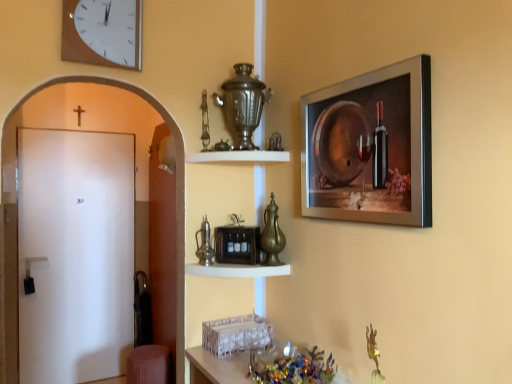
Question: From the image's perspective, is white matte door at left above metallic glass bowl at lower center?

Choices:
 (A) no
 (B) yes

Answer: (B)

Question: Would you say white matte door at left contains metallic glass bowl at lower center?

Choices:
 (A) yes
 (B) no

Answer: (B)

Question: Is white matte door at left thinner than metallic glass bowl at lower center?

Choices:
 (A) yes
 (B) no

Answer: (A)

Question: Is white matte door at left wider than metallic glass bowl at lower center?

Choices:
 (A) yes
 (B) no

Answer: (B)

Question: Considering the relative positions of white matte door at left and metallic glass bowl at lower center in the image provided, is white matte door at left in front of metallic glass bowl at lower center?

Choices:
 (A) no
 (B) yes

Answer: (A)

Question: Can you confirm if white matte door at left is positioned to the right of metallic glass bowl at lower center?

Choices:
 (A) no
 (B) yes

Answer: (A)

Question: From the image's perspective, does metallic black toaster at center, the 2th shelf in the top-to-bottom sequence, appear higher than metallic glass bowl at lower center?

Choices:
 (A) no
 (B) yes

Answer: (B)

Question: From a real-world perspective, is metallic black toaster at center, the 2th shelf in the top-to-bottom sequence, under metallic glass bowl at lower center?

Choices:
 (A) yes
 (B) no

Answer: (B)

Question: Is metallic black toaster at center, which is counted as the 1th shelf, starting from the bottom, directly adjacent to metallic glass bowl at lower center?

Choices:
 (A) yes
 (B) no

Answer: (B)

Question: Is metallic black toaster at center, the 2th shelf in the top-to-bottom sequence, surrounding metallic glass bowl at lower center?

Choices:
 (A) yes
 (B) no

Answer: (B)

Question: Is metallic black toaster at center, which is counted as the 1th shelf, starting from the bottom, closer to the viewer compared to metallic glass bowl at lower center?

Choices:
 (A) no
 (B) yes

Answer: (A)

Question: Can you confirm if metallic black toaster at center, which is counted as the 1th shelf, starting from the bottom, is shorter than metallic glass bowl at lower center?

Choices:
 (A) no
 (B) yes

Answer: (B)

Question: From the image's perspective, is white glossy shelf at upper center, which appears as the first shelf when viewed from the top, above metallic black toaster at center, which is counted as the 1th shelf, starting from the bottom?

Choices:
 (A) yes
 (B) no

Answer: (A)